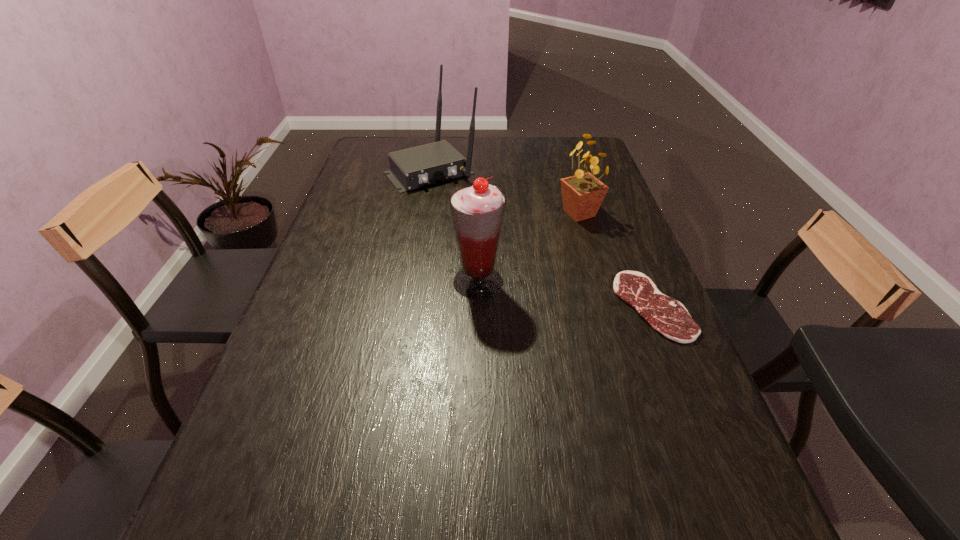
At what (x,y) coordinates should I click in order to perform the action: click on vacant area situated 0.080m at the front of the sunflower with flowers visible. Please return your answer as a coordinate pair (x, y). Looking at the image, I should click on (569, 240).

Identify the location of vacant space positioned 0.230m at the front of the sunflower with flowers visible. Image resolution: width=960 pixels, height=540 pixels. (557, 272).

This screenshot has width=960, height=540. Find the location of `free space located 0.360m at the front of the sunflower with flowers visible`. free space located 0.360m at the front of the sunflower with flowers visible is located at coordinates (545, 305).

You are a GUI agent. You are given a task and a screenshot of the screen. Output one action in this format:
    pyautogui.click(x=<x>, y=<y>)
    Task: Click on the object that is positioned at the far edge
    
    Given the screenshot: What is the action you would take?
    pyautogui.click(x=416, y=167)

I want to click on object at the left edge, so click(416, 167).

The height and width of the screenshot is (540, 960). Find the location of `steak positioned at the right edge`. steak positioned at the right edge is located at coordinates (668, 316).

Identify the location of sunflower situated at the right edge. The image size is (960, 540). [582, 194].

You are a GUI agent. You are given a task and a screenshot of the screen. Output one action in this format:
    pyautogui.click(x=<x>, y=<y>)
    Task: Click on the object that is at the far left corner
    This screenshot has height=540, width=960.
    Given the screenshot: What is the action you would take?
    pyautogui.click(x=416, y=167)

Identify the location of vacant space at the far edge of the desktop. (504, 139).

You are a GUI agent. You are given a task and a screenshot of the screen. Output one action in this format:
    pyautogui.click(x=<x>, y=<y>)
    Task: Click on the vacant area at the near edge
    
    Given the screenshot: What is the action you would take?
    pyautogui.click(x=475, y=453)